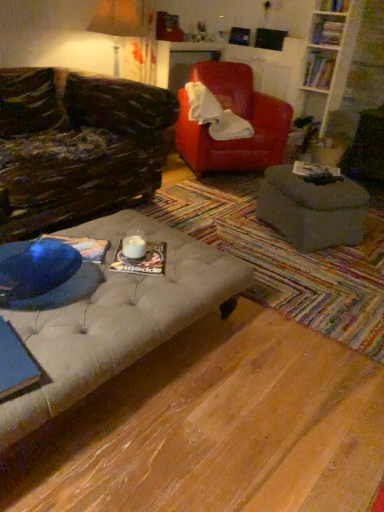
I want to click on vacant area in front of hardcover book at center, acting as the 4th book starting from the right, so click(321, 183).